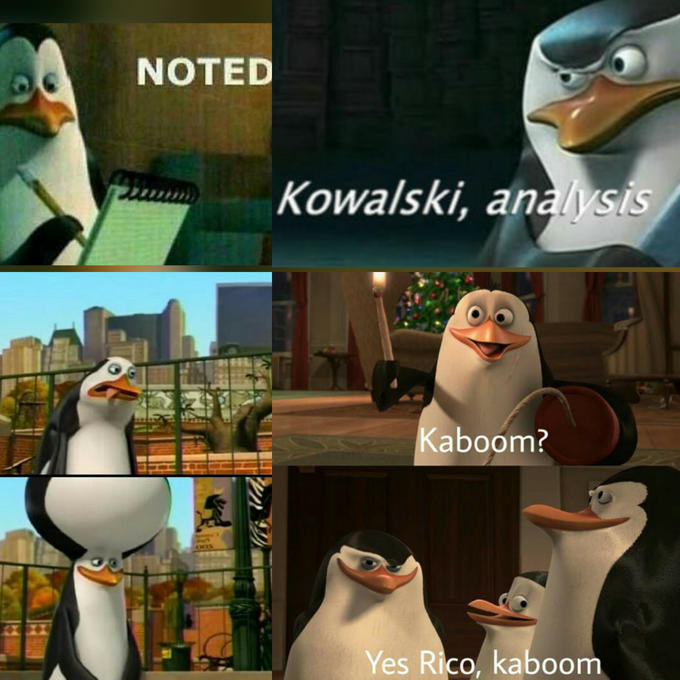
Locate an element on the screen. This screenshot has height=680, width=680. notepad is located at coordinates (153, 220).